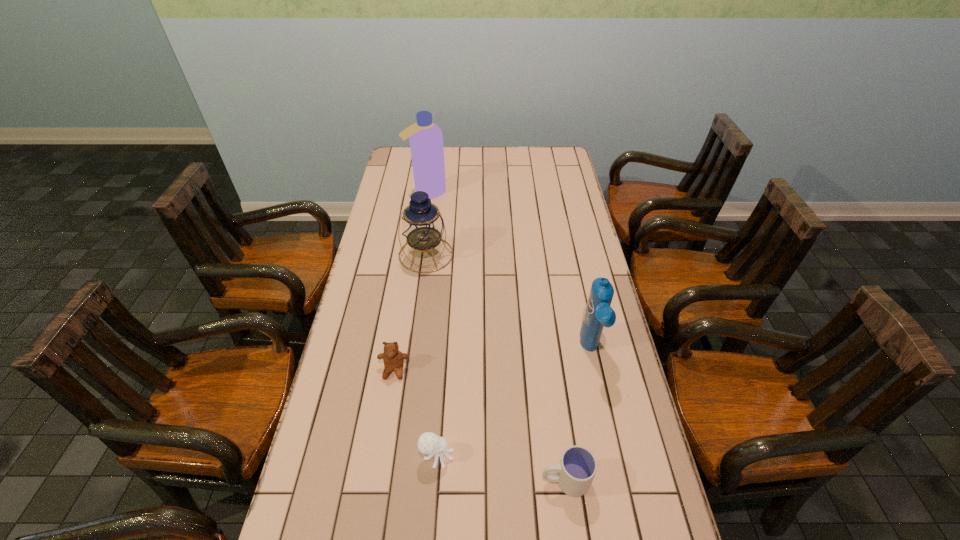
This screenshot has height=540, width=960. What are the coordinates of `cup present at the right edge` in the screenshot? It's located at point(574,474).

At what (x,y) coordinates should I click in order to perform the action: click on free spot at the far edge of the desktop. Please return your answer as a coordinate pair (x, y). This screenshot has height=540, width=960. Looking at the image, I should click on (522, 169).

Identify the location of free space at the left edge of the desktop. The width and height of the screenshot is (960, 540). (337, 402).

The width and height of the screenshot is (960, 540). I want to click on free region at the right edge of the desktop, so click(x=573, y=272).

This screenshot has height=540, width=960. In order to click on free space between the left shampoo and the teddy bear in this screenshot , I will do `click(411, 281)`.

You are a GUI agent. You are given a task and a screenshot of the screen. Output one action in this format:
    pyautogui.click(x=<x>, y=<y>)
    Task: Click on the vacant space that is in between the second farthest object and the shorter shampoo
    
    Given the screenshot: What is the action you would take?
    pyautogui.click(x=508, y=302)

This screenshot has width=960, height=540. In order to click on empty location between the octopus and the teddy bear in this screenshot , I will do `click(416, 413)`.

Identify the location of unoccupied position between the lantern and the octopus. The width and height of the screenshot is (960, 540). (431, 355).

I want to click on unoccupied area between the rightmost object and the taller shampoo, so click(509, 271).

Image resolution: width=960 pixels, height=540 pixels. Find the location of `free space between the tallest object and the teddy bear`. free space between the tallest object and the teddy bear is located at coordinates (411, 281).